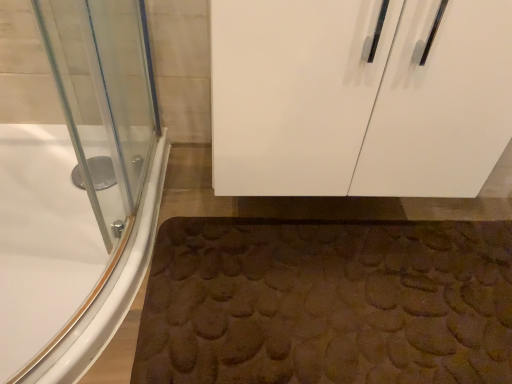
I want to click on brown textured bath mat at lower center, so click(327, 303).

Does brown textured bath mat at lower center lie behind white glossy bathtub at lower left?

Yes, the depth of brown textured bath mat at lower center is greater than that of white glossy bathtub at lower left.

In terms of size, does brown textured bath mat at lower center appear bigger or smaller than white glossy bathtub at lower left?

Clearly, brown textured bath mat at lower center is smaller in size than white glossy bathtub at lower left.

In the scene shown: Would you consider brown textured bath mat at lower center to be distant from white glossy bathtub at lower left?

No.

Considering the sizes of objects brown textured bath mat at lower center and white glossy bathtub at lower left in the image provided, who is taller, brown textured bath mat at lower center or white glossy bathtub at lower left?

With more height is white glossy bathtub at lower left.

Looking at this image, is white glossy bathtub at lower left shorter than brown textured bath mat at lower center?

No.

Considering the sizes of objects white glossy bathtub at lower left and brown textured bath mat at lower center in the image provided, who is wider, white glossy bathtub at lower left or brown textured bath mat at lower center?

Wider between the two is brown textured bath mat at lower center.

In the image, there is a white glossy bathtub at lower left. Identify the location of bath mat below it (from the image's perspective). (327, 303).

Is point (112, 58) closer or farther from the camera than point (327, 312)?

Clearly, point (112, 58) is more distant from the camera than point (327, 312).

Identify the location of door above the brown textured bath mat at lower center (from the image's perspective). (359, 97).

From the picture: Does brown textured bath mat at lower center have a lesser height compared to white glossy cabinet at upper center?

Indeed, brown textured bath mat at lower center has a lesser height compared to white glossy cabinet at upper center.

Between brown textured bath mat at lower center and white glossy cabinet at upper center, which one has smaller width?

brown textured bath mat at lower center is thinner.

From a real-world perspective, is white glossy cabinet at upper center positioned over white glossy bathtub at lower left based on gravity?

Correct, in the physical world, white glossy cabinet at upper center is higher than white glossy bathtub at lower left.

Is point (261, 71) positioned behind point (12, 298)?

No, (261, 71) is closer to viewer.

Is white glossy cabinet at upper center taller than white glossy bathtub at lower left?

Yes.

Is white glossy cabinet at upper center at the left side of white glossy bathtub at lower left?

No.

In the scene shown: From a real-world perspective, is white glossy cabinet at upper center above or below brown textured bath mat at lower center?

white glossy cabinet at upper center is above brown textured bath mat at lower center.

Who is more distant, white glossy cabinet at upper center or brown textured bath mat at lower center?

brown textured bath mat at lower center is more distant.

Based on the photo, does white glossy cabinet at upper center appear on the left side of brown textured bath mat at lower center?

Yes, white glossy cabinet at upper center is to the left of brown textured bath mat at lower center.

In the scene shown: Are white glossy cabinet at upper center and brown textured bath mat at lower center beside each other?

They are not placed beside each other.

Is white glossy bathtub at lower left positioned with its back to white glossy cabinet at upper center?

white glossy bathtub at lower left is not turned away from white glossy cabinet at upper center.

From a real-world perspective, is white glossy bathtub at lower left physically located above or below white glossy cabinet at upper center?

white glossy bathtub at lower left is situated lower than white glossy cabinet at upper center in the real world.

Can you tell me how much white glossy bathtub at lower left and white glossy cabinet at upper center differ in facing direction?

87.3 degrees separate the facing orientations of white glossy bathtub at lower left and white glossy cabinet at upper center.

Considering the positions of points (100, 194) and (249, 124), is point (100, 194) farther from camera compared to point (249, 124)?

Yes, it is behind point (249, 124).

The height and width of the screenshot is (384, 512). What are the coordinates of `bathtub on the left of brown textured bath mat at lower center` in the screenshot? It's located at (79, 193).

This screenshot has width=512, height=384. In order to click on bath mat below the white glossy bathtub at lower left (from the image's perspective) in this screenshot , I will do `click(327, 303)`.

Looking at this image, which object lies nearer to the anchor point white glossy bathtub at lower left, brown textured bath mat at lower center or white glossy cabinet at upper center?

brown textured bath mat at lower center.

Based on their spatial positions, is brown textured bath mat at lower center or white glossy bathtub at lower left closer to white glossy cabinet at upper center?

The object closer to white glossy cabinet at upper center is brown textured bath mat at lower center.

Which object lies further to the anchor point white glossy bathtub at lower left, white glossy cabinet at upper center or brown textured bath mat at lower center?

white glossy cabinet at upper center lies further to white glossy bathtub at lower left than the other object.

Estimate the real-world distances between objects in this image. Which object is further from brown textured bath mat at lower center, white glossy cabinet at upper center or white glossy bathtub at lower left?

white glossy bathtub at lower left is further to brown textured bath mat at lower center.

When comparing their distances from brown textured bath mat at lower center, does white glossy bathtub at lower left or white glossy cabinet at upper center seem further?

Among the two, white glossy bathtub at lower left is located further to brown textured bath mat at lower center.

Consider the image. Looking at the image, which one is located further to white glossy cabinet at upper center, white glossy bathtub at lower left or brown textured bath mat at lower center?

Among the two, white glossy bathtub at lower left is located further to white glossy cabinet at upper center.

Where is `door located between white glossy bathtub at lower left and brown textured bath mat at lower center in the left-right direction`? This screenshot has height=384, width=512. door located between white glossy bathtub at lower left and brown textured bath mat at lower center in the left-right direction is located at coordinates (359, 97).